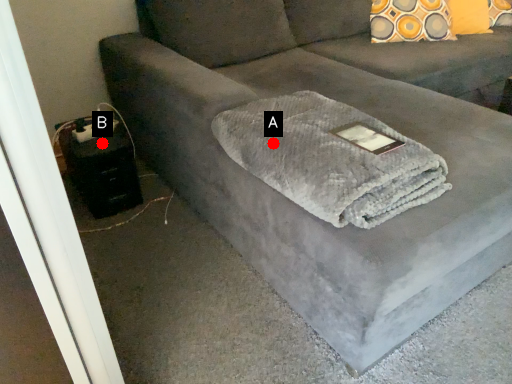
Question: Two points are circled on the image, labeled by A and B beside each circle. Among these points, which one is nearest to the camera?

Choices:
 (A) A is closer
 (B) B is closer

Answer: (A)